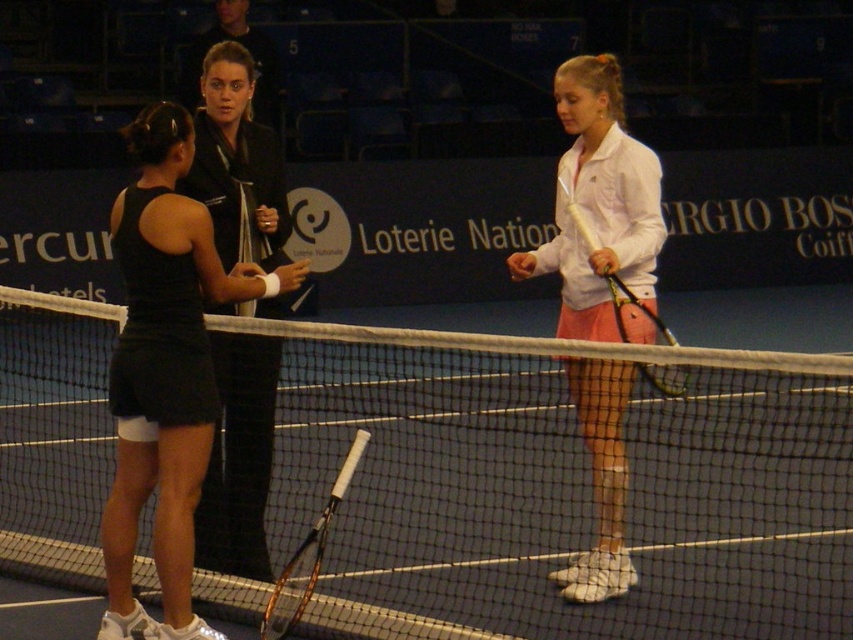
You are a photographer positioned at the baseline of the tennis court. You want to take a photo that includes both the white matte tennis racket at center and the black fabric jacket at center. Which object should you adjust your camera angle to focus on first to ensure both are in frame?

The white matte tennis racket at center is in front of the black fabric jacket at center. To ensure both are in frame, focus on the white matte tennis racket at center first since it is closer to the camera, allowing the black fabric jacket at center to remain visible behind it.

You are a photographer standing at the back of the tennis court. You want to take a photo of the black fabric jacket at center and the yellow grip tennis racket at center. Which object should you focus on first if you want to capture both in the frame without moving the camera?

The black fabric jacket at center is taller than the yellow grip tennis racket at center, so you should focus on the black fabric jacket at center first to ensure it fits within the frame.